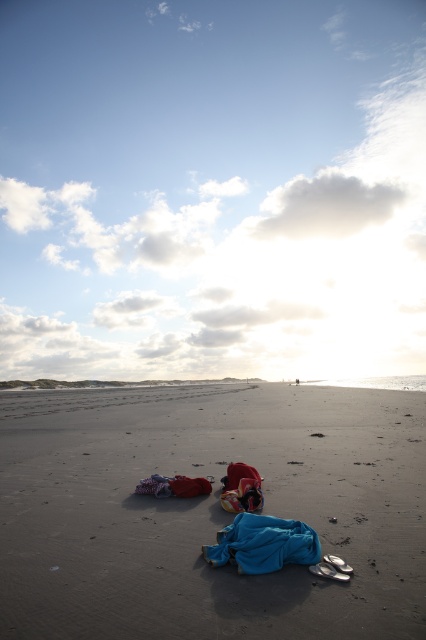
Question: Among these objects, which one is nearest to the camera?

Choices:
 (A) smooth sand at center
 (B) blue fabric at center

Answer: (A)

Question: Which object is closer to the camera taking this photo?

Choices:
 (A) blue cotton blanket at center
 (B) smooth sand at center

Answer: (B)

Question: Observing the image, what is the correct spatial positioning of blue fabric at center in reference to blue cotton blanket at center?

Choices:
 (A) left
 (B) right

Answer: (B)

Question: Is smooth sand at center bigger than blue cotton blanket at center?

Choices:
 (A) no
 (B) yes

Answer: (B)

Question: Is blue fabric at center further to camera compared to blue cotton blanket at center?

Choices:
 (A) no
 (B) yes

Answer: (A)

Question: Among these objects, which one is farthest from the camera?

Choices:
 (A) blue cotton blanket at center
 (B) smooth sand at center

Answer: (A)